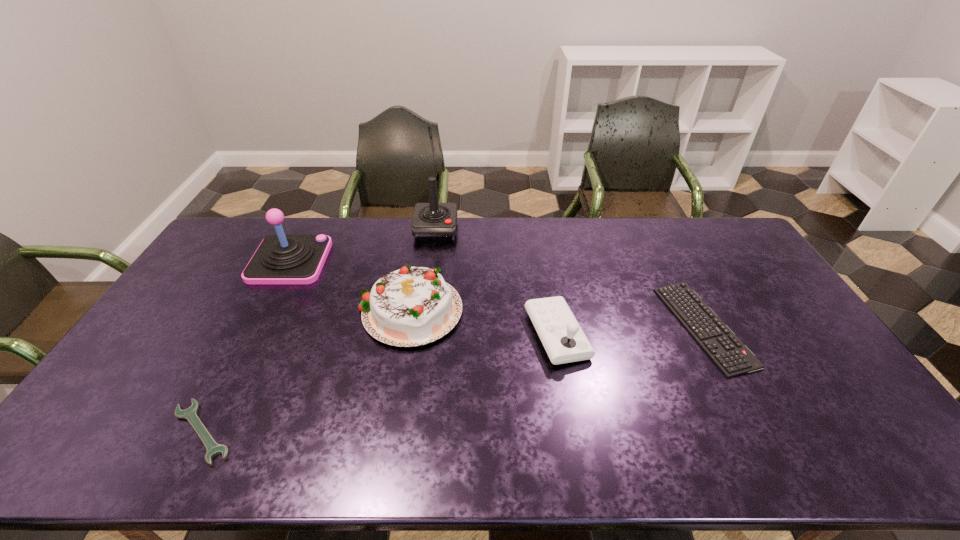
Identify the location of vacant point that satisfies the following two spatial constraints: 1. forward from the base of the computer keyboard; 2. on the right side of the leftmost joystick. The image size is (960, 540). (256, 326).

Locate an element on the screen. The height and width of the screenshot is (540, 960). free spot that satisfies the following two spatial constraints: 1. on the back side of the rightmost joystick; 2. on the left side of the shortest object is located at coordinates (252, 335).

You are a GUI agent. You are given a task and a screenshot of the screen. Output one action in this format:
    pyautogui.click(x=<x>, y=<y>)
    Task: Click on the vacant region that satisfies the following two spatial constraints: 1. forward from the base of the leftmost joystick; 2. on the back side of the third tallest object
    
    Given the screenshot: What is the action you would take?
    pyautogui.click(x=266, y=308)

Locate an element on the screen. This screenshot has height=540, width=960. vacant region that satisfies the following two spatial constraints: 1. on the front-facing side of the computer keyboard; 2. on the left side of the second joystick from right to left is located at coordinates (423, 326).

Find the location of a particular element. free space that satisfies the following two spatial constraints: 1. on the front-facing side of the second joystick from right to left; 2. on the right side of the fifth tallest object is located at coordinates (423, 326).